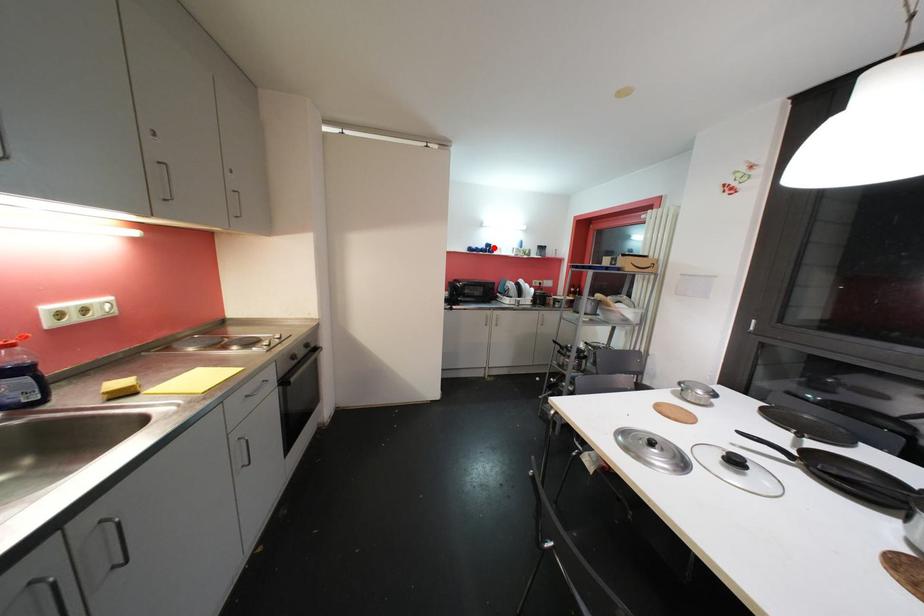
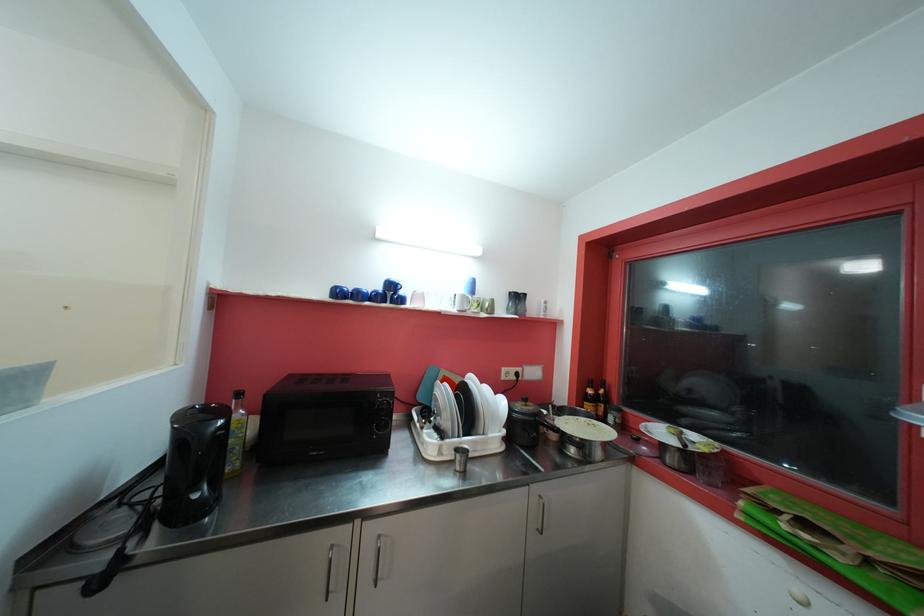
Locate, in the second image, the point that corresponds to the highlighted location in the first image.

(396, 288)